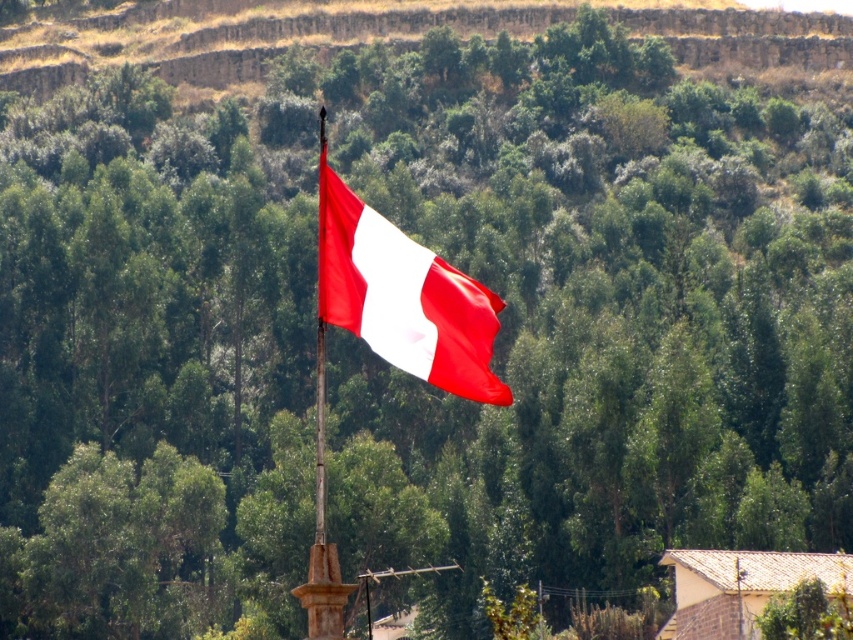
Question: Is matte fabric flag at center to the left of smooth wood flag pole at center from the viewer's perspective?

Choices:
 (A) yes
 (B) no

Answer: (B)

Question: Which of the following is the farthest from the observer?

Choices:
 (A) matte fabric flag at center
 (B) smooth wood flag pole at center

Answer: (B)

Question: Which object appears closest to the camera in this image?

Choices:
 (A) smooth wood flag pole at center
 (B) matte fabric flag at center

Answer: (B)

Question: Does matte fabric flag at center appear under smooth wood flag pole at center?

Choices:
 (A) no
 (B) yes

Answer: (A)

Question: Is matte fabric flag at center smaller than smooth wood flag pole at center?

Choices:
 (A) no
 (B) yes

Answer: (A)